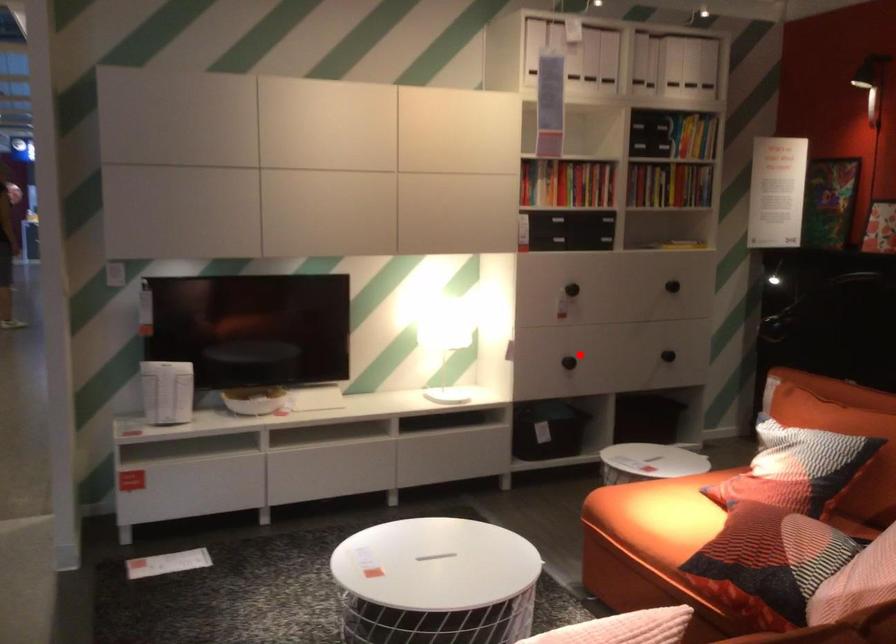
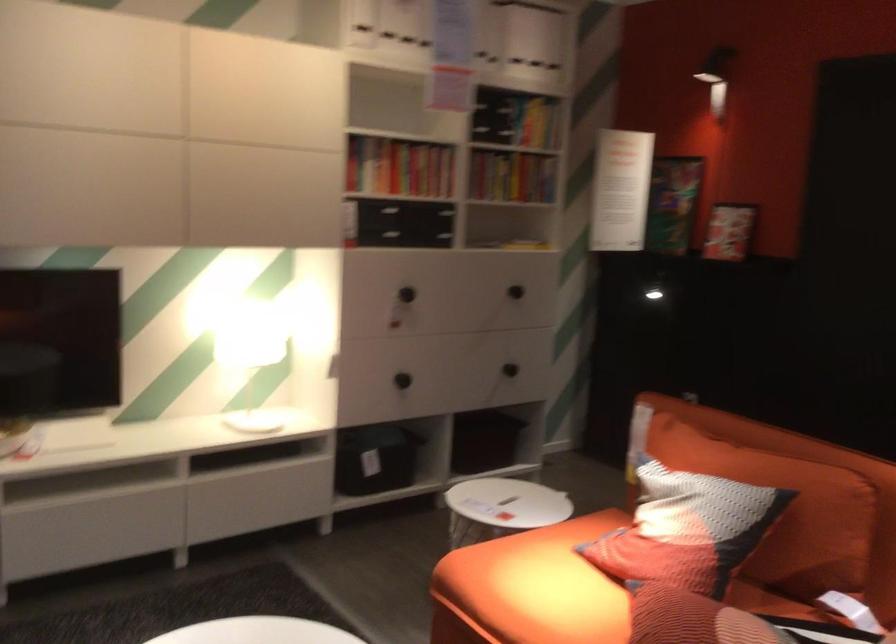
Locate, in the second image, the point that corresponds to the highlighted location in the first image.

(401, 380)